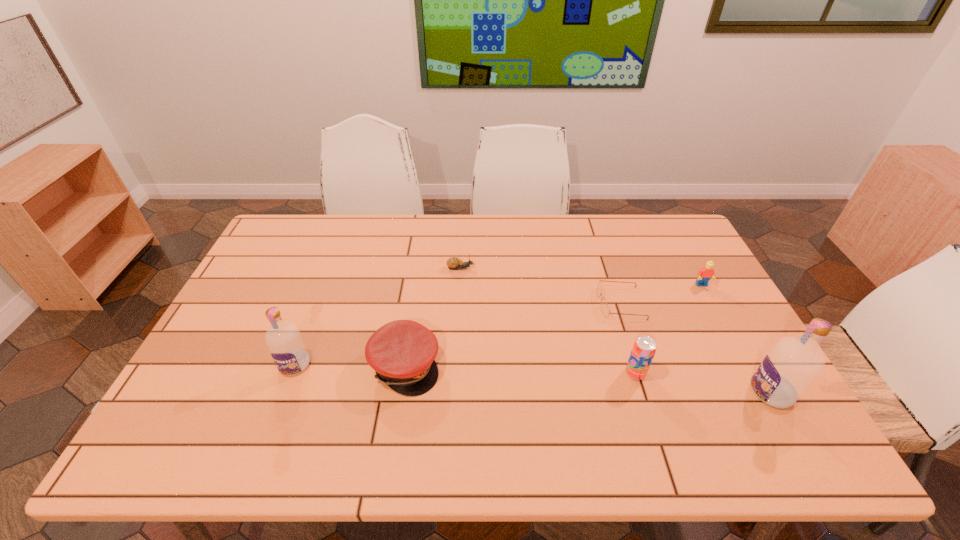
Locate an element on the screen. the leftmost object is located at coordinates (286, 346).

Where is `the left vodka`? the left vodka is located at coordinates (286, 346).

This screenshot has width=960, height=540. In order to click on the tallest object in this screenshot , I will do `click(793, 363)`.

Identify the location of the taller vodka. The height and width of the screenshot is (540, 960). (793, 363).

At what (x,y) coordinates should I click in order to perform the action: click on Lego. Please return your answer as a coordinate pair (x, y). The image size is (960, 540). Looking at the image, I should click on (704, 275).

At what (x,y) coordinates should I click in order to perform the action: click on escargot. Please return your answer as a coordinate pair (x, y). The image size is (960, 540). Looking at the image, I should click on (453, 263).

The width and height of the screenshot is (960, 540). What are the coordinates of `spectacles` in the screenshot? It's located at (604, 306).

In order to click on cap in this screenshot , I will do `click(402, 352)`.

Find the location of a particular element. The width and height of the screenshot is (960, 540). the fifth shortest object is located at coordinates (644, 348).

In order to click on vacant point located 0.090m on the label of the shorter vodka in this screenshot , I will do `click(278, 409)`.